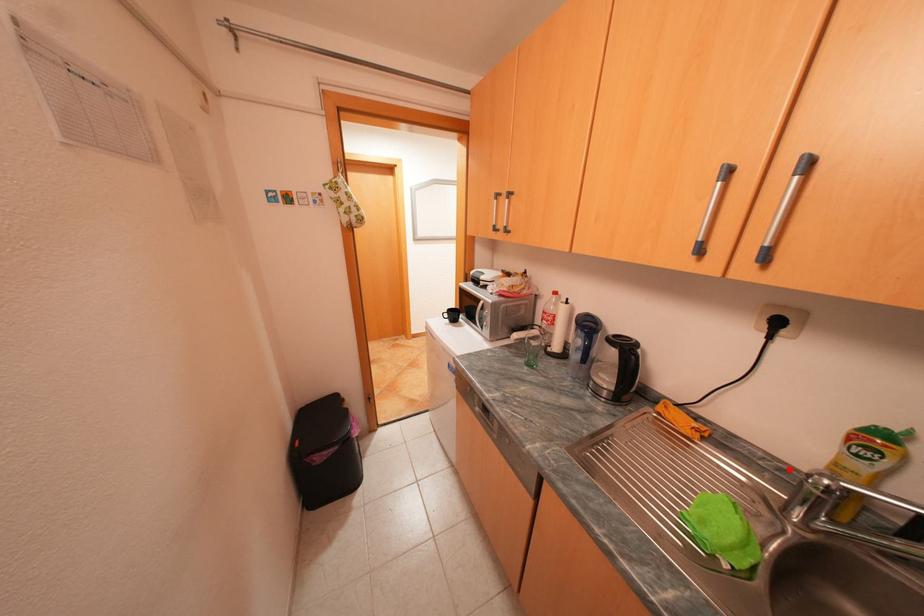
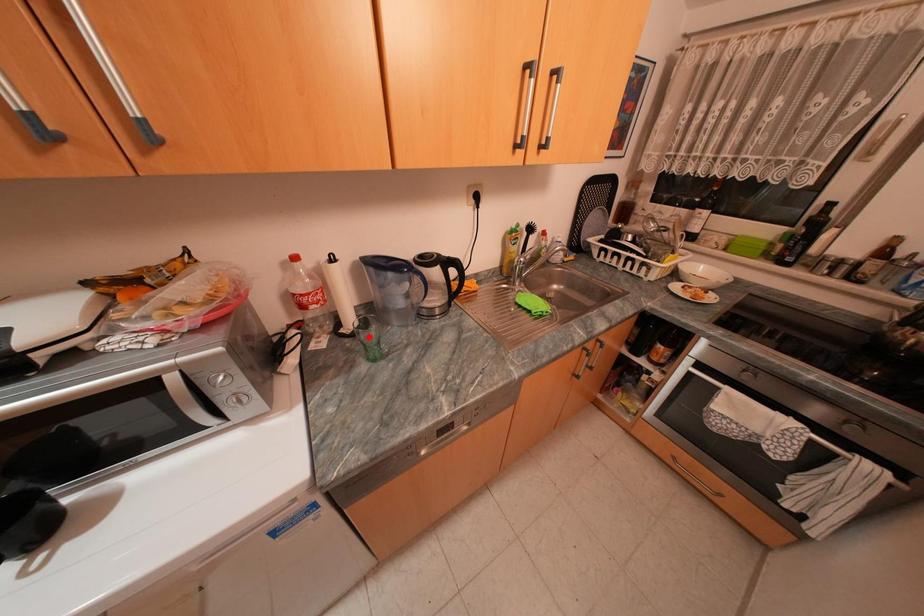
I am providing you with two images of the same scene from different viewpoints. A red point is marked on the first image and another point is marked on the second image. Is the marked point in image1 the same physical position as the marked point in image2?

No